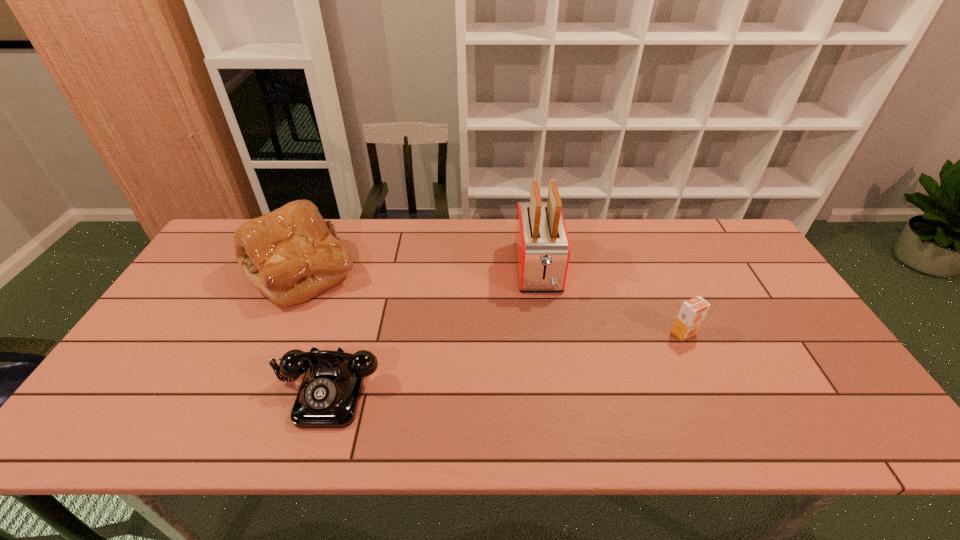
Select which object is the closest to the telephone. Please provide its 2D coordinates. Your answer should be formatted as a tuple, i.e. [(x, y)], where the tuple contains the x and y coordinates of a point satisfying the conditions above.

[(291, 254)]

You are a GUI agent. You are given a task and a screenshot of the screen. Output one action in this format:
    pyautogui.click(x=<x>, y=<y>)
    Task: Click on the vacant area in the image that satisfies the following two spatial constraints: 1. on the filling side of the rightmost object; 2. on the left side of the bread
    
    Given the screenshot: What is the action you would take?
    pyautogui.click(x=273, y=333)

This screenshot has height=540, width=960. Identify the location of vacant region that satisfies the following two spatial constraints: 1. on the front-facing side of the tallest object; 2. on the filling side of the second tallest object. (539, 271).

I want to click on free point that satisfies the following two spatial constraints: 1. on the back side of the orange juice; 2. on the filling side of the third shortest object, so click(x=657, y=271).

I want to click on vacant region that satisfies the following two spatial constraints: 1. on the front-facing side of the toaster; 2. on the right side of the orange juice, so click(547, 333).

The height and width of the screenshot is (540, 960). In order to click on vacant position in the image that satisfies the following two spatial constraints: 1. on the front-facing side of the tallest object; 2. on the filling side of the second tallest object in this screenshot , I will do `click(539, 271)`.

Locate an element on the screen. This screenshot has height=540, width=960. vacant point that satisfies the following two spatial constraints: 1. on the filling side of the second tallest object; 2. on the back side of the orange juice is located at coordinates (273, 333).